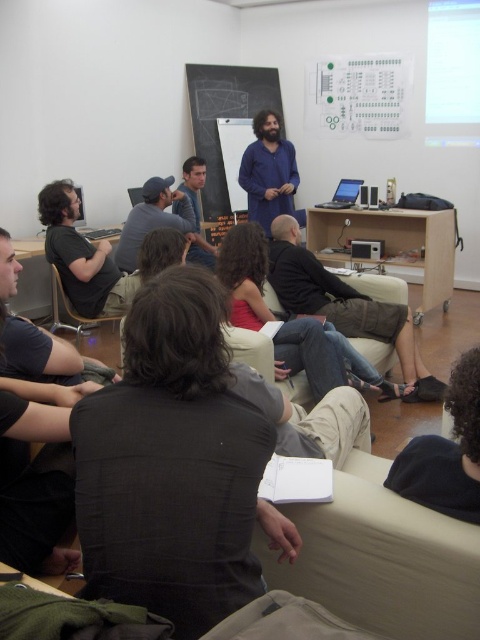
Which of these two, black cotton shirt at center or matte black armchair at center, stands shorter?

Standing shorter between the two is matte black armchair at center.

Between black cotton shirt at center and matte black armchair at center, which one appears on the right side from the viewer's perspective?

Positioned to the right is black cotton shirt at center.

Who is more distant from viewer, (327, 289) or (54, 300)?

Point (54, 300)

Where is `black cotton shirt at center`? This screenshot has width=480, height=640. black cotton shirt at center is located at coordinates click(344, 305).

How much distance is there between matte black armchair at center and silver metallic laptop at center?

The distance of matte black armchair at center from silver metallic laptop at center is 7.99 feet.

Can you confirm if matte black armchair at center is taller than silver metallic laptop at center?

Indeed, matte black armchair at center has a greater height compared to silver metallic laptop at center.

Locate an element on the screen. Image resolution: width=480 pixels, height=640 pixels. matte black armchair at center is located at coordinates (72, 310).

This screenshot has width=480, height=640. I want to click on matte black armchair at center, so click(x=72, y=310).

Which of these two, dark gray shirt at left or matte black cap at center, stands shorter?

Standing shorter between the two is dark gray shirt at left.

Which is behind, point (1, 236) or point (124, 266)?

Positioned behind is point (124, 266).

The width and height of the screenshot is (480, 640). I want to click on dark gray shirt at left, so click(x=35, y=339).

The width and height of the screenshot is (480, 640). Find the location of `dark gray shirt at left`. dark gray shirt at left is located at coordinates (35, 339).